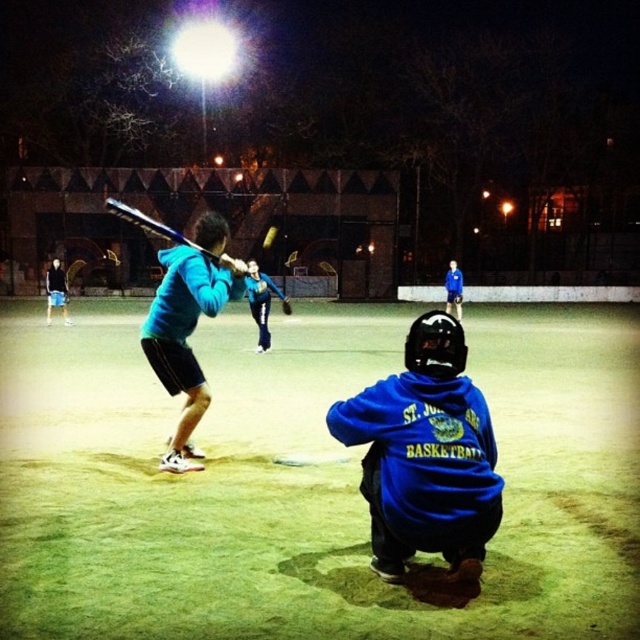
Question: Estimate the real-world distances between objects in this image. Which object is closer to the blue fleece jacket at lower center?

Choices:
 (A) dark blue hoodie at left
 (B) blue hoodie at center

Answer: (B)

Question: Does blue fleece jacket at lower center have a greater width compared to matte blue baseball bat at center?

Choices:
 (A) no
 (B) yes

Answer: (A)

Question: Among these points, which one is nearest to the camera?

Choices:
 (A) coord(176,438)
 (B) coord(49,273)
 (C) coord(200,250)

Answer: (C)

Question: Which point is closer to the camera?

Choices:
 (A) dark blue hoodie at left
 (B) matte blue baseball bat at center
 (C) blue hoodie at center
 (D) blue fleece jacket at lower center

Answer: (D)

Question: Can you confirm if dark blue hoodie at left is positioned below blue hoodie at center?

Choices:
 (A) yes
 (B) no

Answer: (A)

Question: Does blue fleece jacket at lower center have a greater width compared to blue hoodie at center?

Choices:
 (A) no
 (B) yes

Answer: (A)